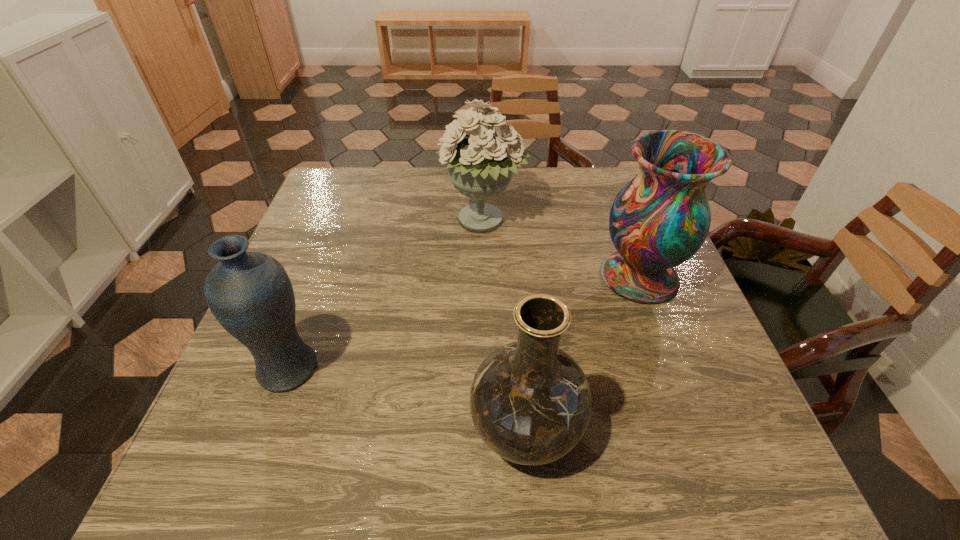
At what (x,y) coordinates should I click in order to perform the action: click on the farthest object. Please return your answer as a coordinate pair (x, y). The height and width of the screenshot is (540, 960). Looking at the image, I should click on (480, 165).

Where is `the farthest vase`? the farthest vase is located at coordinates (660, 219).

Where is `the third nearest object`? The width and height of the screenshot is (960, 540). the third nearest object is located at coordinates (660, 219).

You are a GUI agent. You are given a task and a screenshot of the screen. Output one action in this format:
    pyautogui.click(x=<x>, y=<y>)
    Task: Click on the leftmost vase
    Image resolution: width=960 pixels, height=540 pixels.
    Given the screenshot: What is the action you would take?
    [x=250, y=294]

Find the location of `the second vase from left to right`. the second vase from left to right is located at coordinates (531, 403).

Where is `free spot located 0.300m on the front of the farthest object`? free spot located 0.300m on the front of the farthest object is located at coordinates (483, 343).

At what (x,y) coordinates should I click in order to perform the action: click on free space located 0.360m on the back of the rightmost object. Please return your answer as a coordinate pair (x, y). The height and width of the screenshot is (540, 960). Looking at the image, I should click on (601, 174).

The height and width of the screenshot is (540, 960). In order to click on vacant space situated 0.270m on the right of the leftmost object in this screenshot , I will do `click(461, 369)`.

Find the location of a particular element. The height and width of the screenshot is (540, 960). vacant space positioned on the right of the second vase from right to left is located at coordinates (714, 429).

The image size is (960, 540). Identify the location of object that is positioned at the far edge. (480, 165).